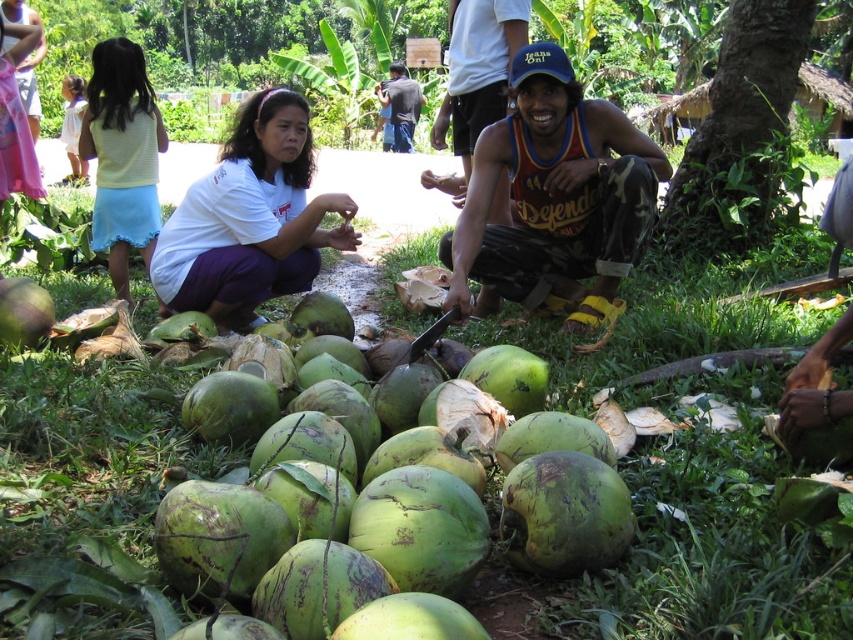
Between point (335, 516) and point (248, 138), which one is positioned behind?

The point (248, 138) is more distant.

Identify the location of green rough coconut at center. Image resolution: width=853 pixels, height=640 pixels. (328, 525).

Identify the location of green rough coconut at center. (328, 525).

Can you confirm if green grass at center is thinner than dark blue t-shirt at center?

Incorrect, green grass at center's width is not less than dark blue t-shirt at center's.

Is green grass at center taller than dark blue t-shirt at center?

No.

The width and height of the screenshot is (853, 640). I want to click on green grass at center, so click(x=152, y=486).

Is point (527, 104) behind point (149, 211)?

That is False.

Is point (531, 131) farther from camera compared to point (157, 200)?

No, it is in front of (157, 200).

Locate an element on the screen. camouflage pants at center is located at coordinates (554, 198).